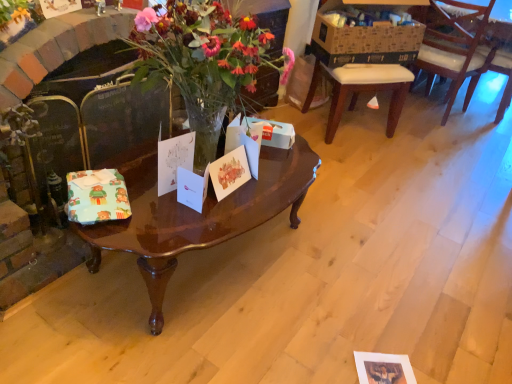
Find the location of a particular element. The image size is (512, 384). unoccupied area in front of white paper gift card at center, arranged as the third gift card when viewed from the right is located at coordinates pyautogui.click(x=160, y=210).